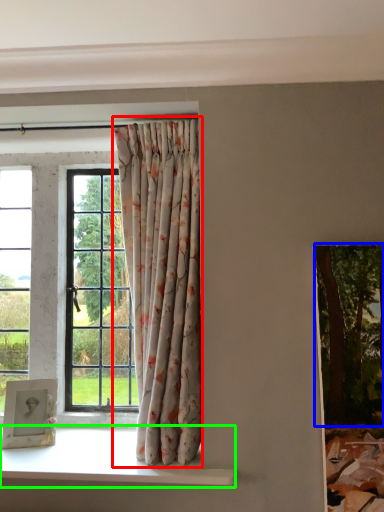
Question: Which object is positioned farthest from curtain (highlighted by a red box)? Select from tree (highlighted by a blue box) and window sill (highlighted by a green box).

Choices:
 (A) tree
 (B) window sill

Answer: (A)